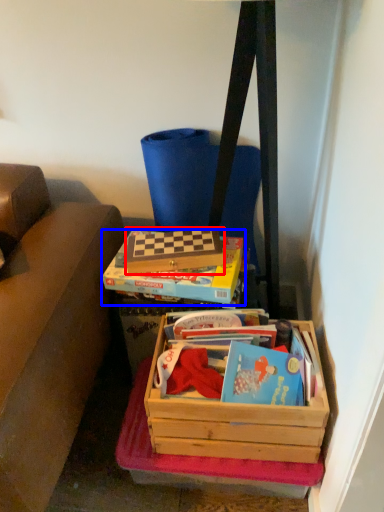
Question: Which of the following is the closest to the observer, box (highlighted by a red box) or box (highlighted by a blue box)?

Choices:
 (A) box
 (B) box

Answer: (B)